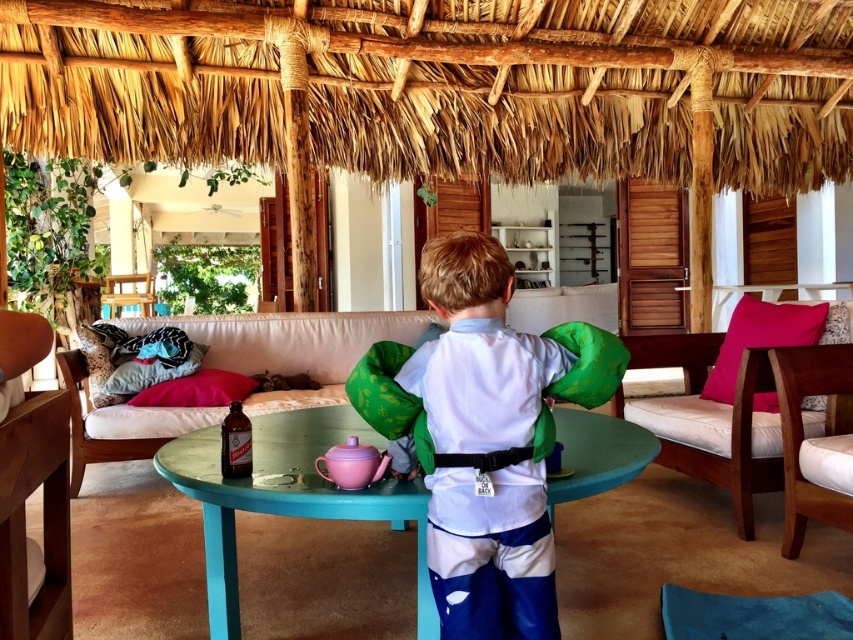
Question: Is white fabric shirt at center above teal painted wood table at center?

Choices:
 (A) yes
 (B) no

Answer: (A)

Question: Does teal painted wood table at center have a lesser width compared to pink fabric pillow at center?

Choices:
 (A) yes
 (B) no

Answer: (B)

Question: In this image, where is white fabric couch at right located relative to pink fabric pillow at center?

Choices:
 (A) right
 (B) left

Answer: (A)

Question: Among these points, which one is farthest from the camera?

Choices:
 (A) (228, 624)
 (B) (74, 461)
 (C) (669, 456)

Answer: (B)

Question: Which point is closer to the camera?

Choices:
 (A) (231, 604)
 (B) (344, 355)

Answer: (A)

Question: Which point is farther to the camera?

Choices:
 (A) (416, 609)
 (B) (762, 435)
 (C) (115, 365)
 (D) (59, 356)

Answer: (C)